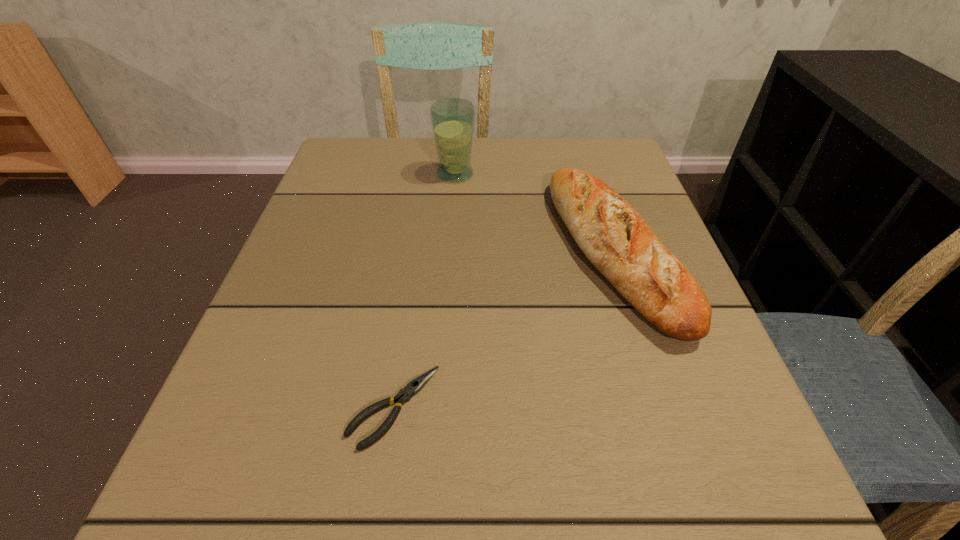
Locate which object ranks in proximity to the second tallest object. Please provide its 2D coordinates. Your answer should be formatted as a tuple, i.e. [(x, y)], where the tuple contains the x and y coordinates of a point satisfying the conditions above.

[(452, 119)]

Locate an element on the screen. The height and width of the screenshot is (540, 960). the second closest object to the baguet is located at coordinates (413, 387).

Where is `free space that satisfies the following two spatial constraints: 1. on the back side of the baguet; 2. on the right side of the pliers`? free space that satisfies the following two spatial constraints: 1. on the back side of the baguet; 2. on the right side of the pliers is located at coordinates (418, 252).

At what (x,y) coordinates should I click in order to perform the action: click on free space that satisfies the following two spatial constraints: 1. on the front side of the rightmost object; 2. on the left side of the glass. Please return your answer as a coordinate pair (x, y). The image size is (960, 540). Looking at the image, I should click on (449, 252).

I want to click on vacant region that satisfies the following two spatial constraints: 1. on the back side of the second tallest object; 2. on the right side of the shortest object, so click(x=418, y=252).

This screenshot has height=540, width=960. I want to click on vacant space that satisfies the following two spatial constraints: 1. on the front side of the glass; 2. on the left side of the second shortest object, so click(449, 252).

Identify the location of blank area in the image that satisfies the following two spatial constraints: 1. on the front side of the tallest object; 2. on the right side of the second shortest object. (449, 252).